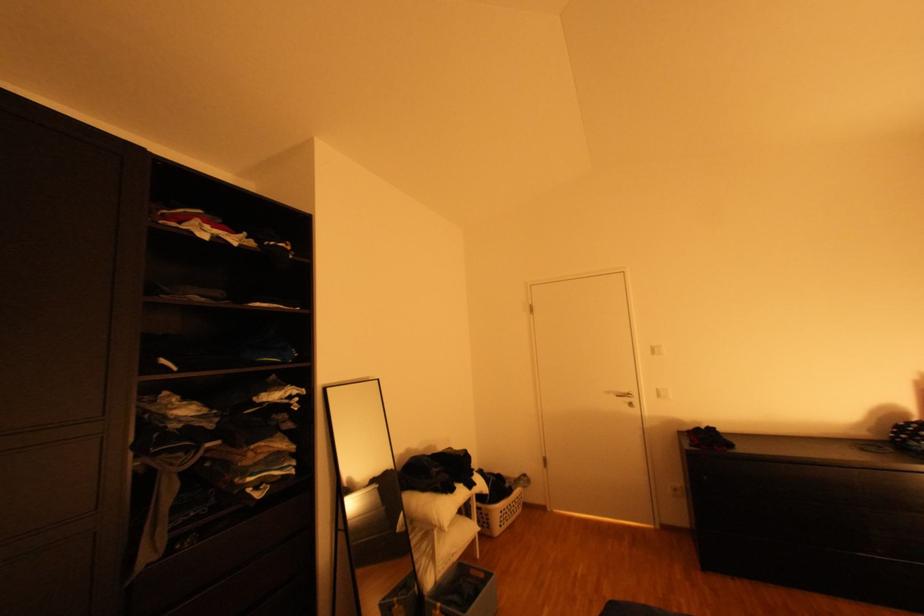
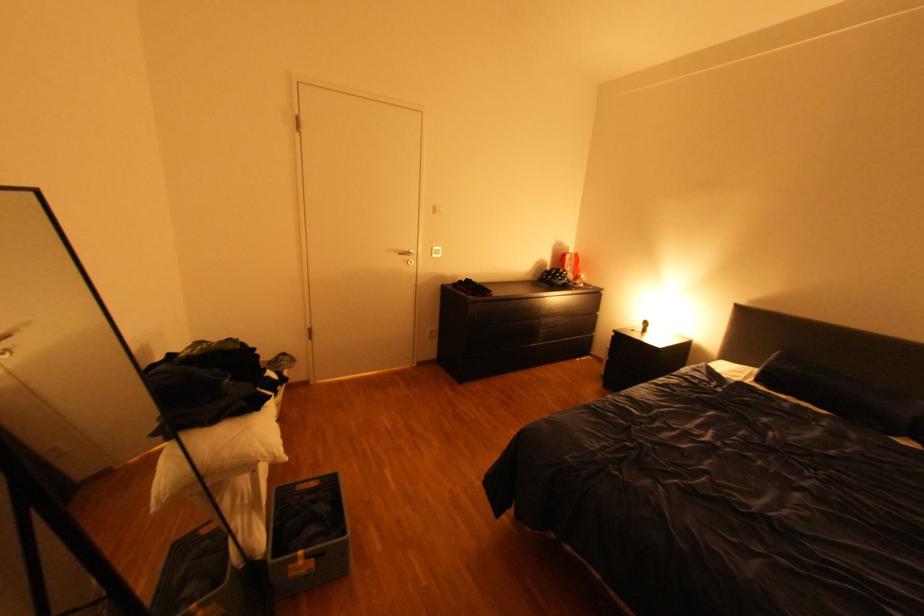
The point at [617,392] is marked in the first image. Where is the corresponding point in the second image?

(399, 249)